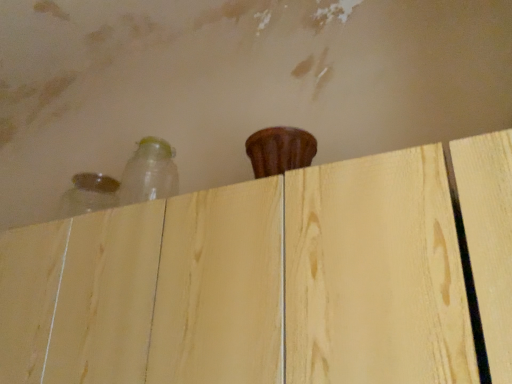
At what (x,y) coordinates should I click in order to perform the action: click on translucent glass bottle at upper left, the 2th bottle when ordered from right to left. Please return your answer as a coordinate pair (x, y). This screenshot has width=512, height=384. Looking at the image, I should click on (88, 194).

The image size is (512, 384). Find the location of `light wood dresser at upper center`. light wood dresser at upper center is located at coordinates (249, 284).

What is the approximate width of light wood dresser at upper center?

The width of light wood dresser at upper center is 13.96 inches.

This screenshot has height=384, width=512. I want to click on translucent glass bottle at upper left, which appears as the 1th bottle when viewed from the left, so click(88, 194).

Which object is positioned more to the left, transparent plastic bottle at upper left, the second bottle from the left, or translucent glass bottle at upper left, which appears as the 1th bottle when viewed from the left?

From the viewer's perspective, translucent glass bottle at upper left, which appears as the 1th bottle when viewed from the left, appears more on the left side.

Does transparent plastic bottle at upper left, marked as the 1th bottle in a right-to-left arrangement, turn towards translucent glass bottle at upper left, which appears as the 1th bottle when viewed from the left?

No, transparent plastic bottle at upper left, marked as the 1th bottle in a right-to-left arrangement, does not turn towards translucent glass bottle at upper left, which appears as the 1th bottle when viewed from the left.

Is transparent plastic bottle at upper left, the second bottle from the left, placed right next to translucent glass bottle at upper left, the 2th bottle when ordered from right to left?

transparent plastic bottle at upper left, the second bottle from the left, and translucent glass bottle at upper left, the 2th bottle when ordered from right to left, are clearly separated.

Would you say transparent plastic bottle at upper left, marked as the 1th bottle in a right-to-left arrangement, is outside translucent glass bottle at upper left, the 2th bottle when ordered from right to left?

That's correct, transparent plastic bottle at upper left, marked as the 1th bottle in a right-to-left arrangement, is outside of translucent glass bottle at upper left, the 2th bottle when ordered from right to left.

Locate an element on the screen. bottle below the transparent plastic bottle at upper left, the second bottle from the left (from a real-world perspective) is located at coordinates (88, 194).

Consider the image. Considering the positions of objects translucent glass bottle at upper left, which appears as the 1th bottle when viewed from the left, and transparent plastic bottle at upper left, marked as the 1th bottle in a right-to-left arrangement, in the image provided, who is in front, translucent glass bottle at upper left, which appears as the 1th bottle when viewed from the left, or transparent plastic bottle at upper left, marked as the 1th bottle in a right-to-left arrangement,?

transparent plastic bottle at upper left, marked as the 1th bottle in a right-to-left arrangement, is closer to the camera.

Is translucent glass bottle at upper left, the 2th bottle when ordered from right to left, far from transparent plastic bottle at upper left, the second bottle from the left?

No, translucent glass bottle at upper left, the 2th bottle when ordered from right to left, is in close proximity to transparent plastic bottle at upper left, the second bottle from the left.

Between point (96, 197) and point (138, 194), which one is positioned behind?

The point (96, 197) is more distant.

From the image's perspective, does light wood dresser at upper center appear higher than translucent glass bottle at upper left, the 2th bottle when ordered from right to left?

No, from the image's perspective, light wood dresser at upper center is not on top of translucent glass bottle at upper left, the 2th bottle when ordered from right to left.

Are light wood dresser at upper center and translucent glass bottle at upper left, the 2th bottle when ordered from right to left, making contact?

light wood dresser at upper center and translucent glass bottle at upper left, the 2th bottle when ordered from right to left, are not in contact.

Which is in front, point (371, 257) or point (60, 212)?

The point (371, 257) is closer to the camera.

Considering the sizes of light wood dresser at upper center and translucent glass bottle at upper left, the 2th bottle when ordered from right to left, in the image, is light wood dresser at upper center wider or thinner than translucent glass bottle at upper left, the 2th bottle when ordered from right to left,?

In the image, light wood dresser at upper center appears to be wider than translucent glass bottle at upper left, the 2th bottle when ordered from right to left.

From a real-world perspective, is transparent plastic bottle at upper left, the second bottle from the left, located beneath light wood dresser at upper center?

No, from a real-world perspective, transparent plastic bottle at upper left, the second bottle from the left, is not under light wood dresser at upper center.

Is transparent plastic bottle at upper left, the second bottle from the left, positioned far away from light wood dresser at upper center?

transparent plastic bottle at upper left, the second bottle from the left, is near light wood dresser at upper center, not far away.

Who is more distant, transparent plastic bottle at upper left, marked as the 1th bottle in a right-to-left arrangement, or light wood dresser at upper center?

transparent plastic bottle at upper left, marked as the 1th bottle in a right-to-left arrangement, is behind.

Does transparent plastic bottle at upper left, the second bottle from the left, contain light wood dresser at upper center?

No, light wood dresser at upper center is not a part of transparent plastic bottle at upper left, the second bottle from the left.

From a real-world perspective, is light wood dresser at upper center physically located above or below transparent plastic bottle at upper left, the second bottle from the left?

From a real-world perspective, light wood dresser at upper center is physically below transparent plastic bottle at upper left, the second bottle from the left.

Could you tell me if light wood dresser at upper center is turned towards transparent plastic bottle at upper left, marked as the 1th bottle in a right-to-left arrangement?

No, light wood dresser at upper center is not turned towards transparent plastic bottle at upper left, marked as the 1th bottle in a right-to-left arrangement.

Is light wood dresser at upper center in front of or behind transparent plastic bottle at upper left, the second bottle from the left, in the image?

Visually, light wood dresser at upper center is located in front of transparent plastic bottle at upper left, the second bottle from the left.

Can you confirm if translucent glass bottle at upper left, the 2th bottle when ordered from right to left, is positioned to the right of light wood dresser at upper center?

No, translucent glass bottle at upper left, the 2th bottle when ordered from right to left, is not to the right of light wood dresser at upper center.

Can you confirm if translucent glass bottle at upper left, which appears as the 1th bottle when viewed from the left, is wider than light wood dresser at upper center?

Incorrect, the width of translucent glass bottle at upper left, which appears as the 1th bottle when viewed from the left, does not surpass that of light wood dresser at upper center.

From a real-world perspective, which object stands above the other?

In real-world perspective, translucent glass bottle at upper left, which appears as the 1th bottle when viewed from the left, is above.

Who is smaller, translucent glass bottle at upper left, which appears as the 1th bottle when viewed from the left, or light wood dresser at upper center?

translucent glass bottle at upper left, which appears as the 1th bottle when viewed from the left, is smaller.

At what (x,y) coordinates should I click in order to perform the action: click on bottle that is behind the transparent plastic bottle at upper left, marked as the 1th bottle in a right-to-left arrangement. Please return your answer as a coordinate pair (x, y). Image resolution: width=512 pixels, height=384 pixels. Looking at the image, I should click on (88, 194).

The image size is (512, 384). What are the coordinates of `bottle on the left of the transparent plastic bottle at upper left, the second bottle from the left` in the screenshot? It's located at (88, 194).

When comparing their distances from light wood dresser at upper center, does transparent plastic bottle at upper left, marked as the 1th bottle in a right-to-left arrangement, or translucent glass bottle at upper left, which appears as the 1th bottle when viewed from the left, seem closer?

Among the two, transparent plastic bottle at upper left, marked as the 1th bottle in a right-to-left arrangement, is located nearer to light wood dresser at upper center.

From the picture: When comparing their distances from transparent plastic bottle at upper left, marked as the 1th bottle in a right-to-left arrangement, does translucent glass bottle at upper left, which appears as the 1th bottle when viewed from the left, or light wood dresser at upper center seem closer?

translucent glass bottle at upper left, which appears as the 1th bottle when viewed from the left, lies closer to transparent plastic bottle at upper left, marked as the 1th bottle in a right-to-left arrangement, than the other object.

Which object lies further to the anchor point translucent glass bottle at upper left, the 2th bottle when ordered from right to left, transparent plastic bottle at upper left, marked as the 1th bottle in a right-to-left arrangement, or light wood dresser at upper center?

light wood dresser at upper center is positioned further to the anchor translucent glass bottle at upper left, the 2th bottle when ordered from right to left.

When comparing their distances from translucent glass bottle at upper left, which appears as the 1th bottle when viewed from the left, does light wood dresser at upper center or transparent plastic bottle at upper left, the second bottle from the left, seem closer?

transparent plastic bottle at upper left, the second bottle from the left.

From the image, which object appears to be nearer to transparent plastic bottle at upper left, marked as the 1th bottle in a right-to-left arrangement, light wood dresser at upper center or translucent glass bottle at upper left, the 2th bottle when ordered from right to left?

The object closer to transparent plastic bottle at upper left, marked as the 1th bottle in a right-to-left arrangement, is translucent glass bottle at upper left, the 2th bottle when ordered from right to left.

From the image, which object appears to be farther from light wood dresser at upper center, translucent glass bottle at upper left, the 2th bottle when ordered from right to left, or transparent plastic bottle at upper left, the second bottle from the left?

translucent glass bottle at upper left, the 2th bottle when ordered from right to left, is further to light wood dresser at upper center.

Where is `bottle between light wood dresser at upper center and translucent glass bottle at upper left, which appears as the 1th bottle when viewed from the left, from front to back`? This screenshot has width=512, height=384. bottle between light wood dresser at upper center and translucent glass bottle at upper left, which appears as the 1th bottle when viewed from the left, from front to back is located at coordinates (149, 173).